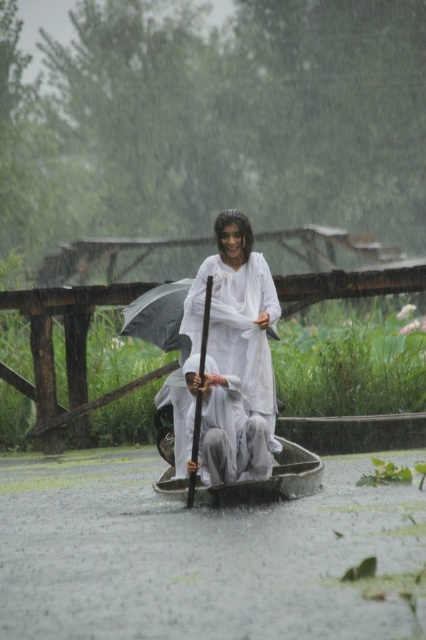
Question: Is white cotton man at center bigger than transparent nylon umbrella at center?

Choices:
 (A) no
 (B) yes

Answer: (A)

Question: Which is farther from the transparent nylon umbrella at center?

Choices:
 (A) white matte cloth at center
 (B) white cotton man at center

Answer: (B)

Question: Which object is positioned farthest from the white matte cloth at center?

Choices:
 (A) white cotton man at center
 (B) transparent nylon umbrella at center

Answer: (B)

Question: Does white cotton man at center come behind transparent nylon umbrella at center?

Choices:
 (A) no
 (B) yes

Answer: (A)

Question: In this image, where is white cotton man at center located relative to transparent nylon umbrella at center?

Choices:
 (A) above
 (B) below

Answer: (B)

Question: Which is farther from the white cotton man at center?

Choices:
 (A) white matte cloth at center
 (B) transparent nylon umbrella at center

Answer: (B)